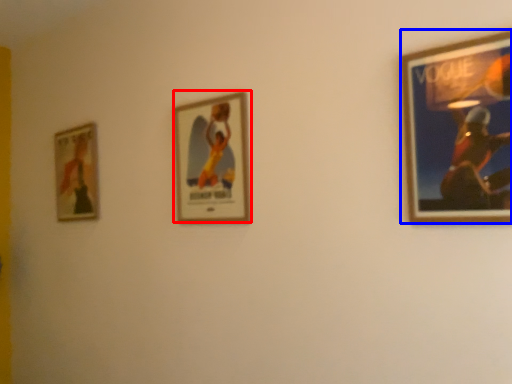
Question: Which of the following is the farthest to the observer, picture frame (highlighted by a red box) or picture frame (highlighted by a blue box)?

Choices:
 (A) picture frame
 (B) picture frame

Answer: (A)